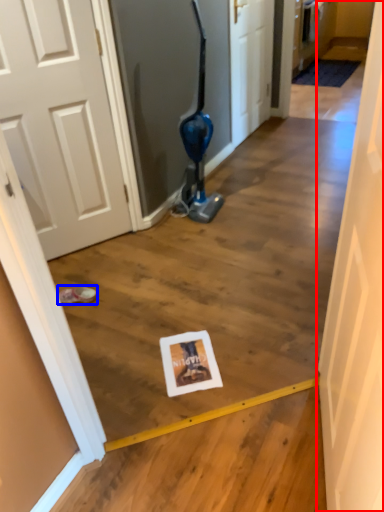
Question: Which point is further to the camera, door (highlighted by a red box) or footwear (highlighted by a blue box)?

Choices:
 (A) door
 (B) footwear

Answer: (B)